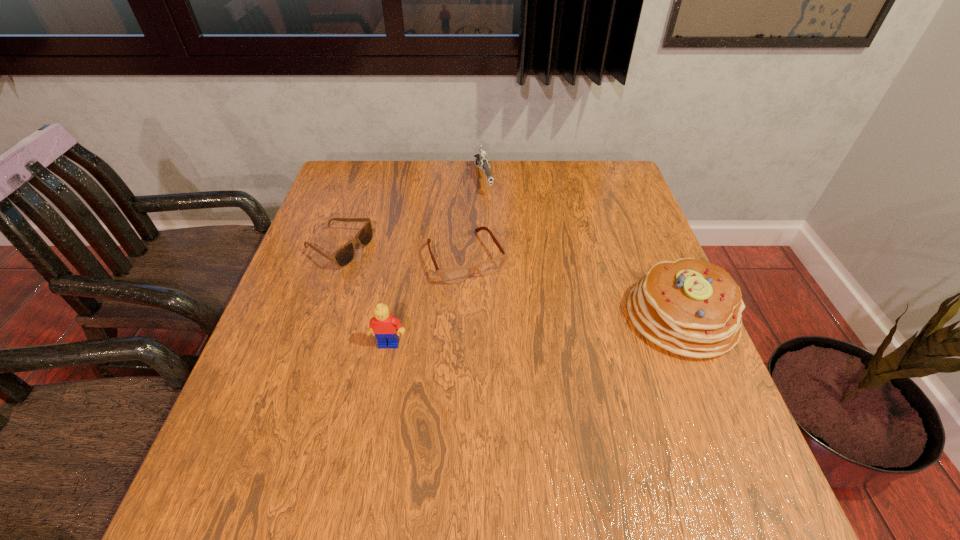
Find the location of a particular element. This screenshot has height=540, width=960. the fourth object from right to left is located at coordinates (384, 326).

I want to click on pancake, so click(x=690, y=307).

The height and width of the screenshot is (540, 960). What are the coordinates of `the third tallest object` in the screenshot? It's located at point(481,160).

Find the location of a particular element. The image size is (960, 540). gun is located at coordinates (481, 160).

The width and height of the screenshot is (960, 540). What are the coordinates of `spectacles` in the screenshot? It's located at (450, 275).

The image size is (960, 540). Find the location of `the leftmost object`. the leftmost object is located at coordinates tap(343, 256).

In order to click on vacant position located 0.130m on the face of the fourth object from right to left in this screenshot , I will do `click(378, 406)`.

Where is `free space located 0.060m on the front of the rightmost object`? free space located 0.060m on the front of the rightmost object is located at coordinates (710, 388).

I want to click on vacant space located 0.220m aimed along the barrel of the farthest object, so click(x=501, y=246).

Find the location of `vacant space located 0.100m aimed along the barrel of the farthest object`. vacant space located 0.100m aimed along the barrel of the farthest object is located at coordinates (492, 219).